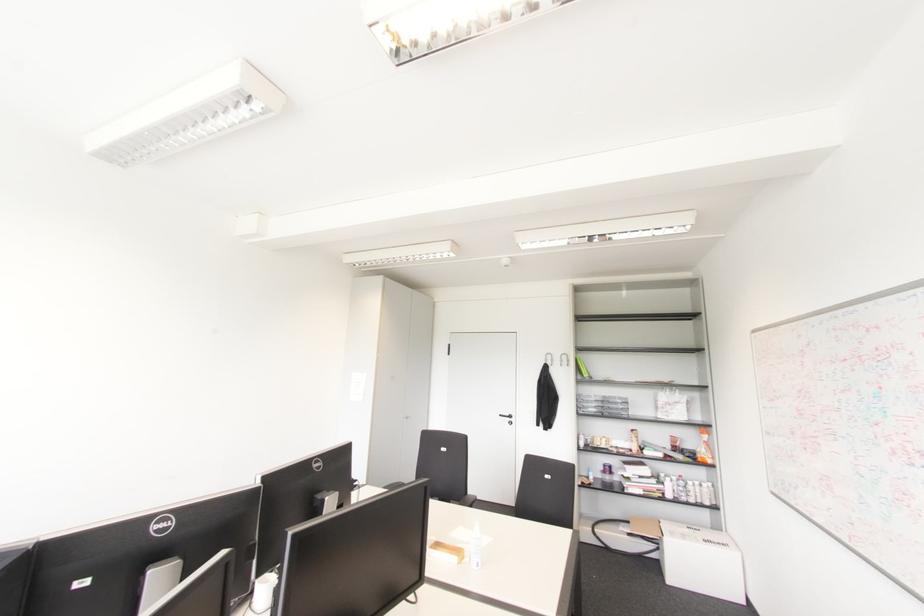
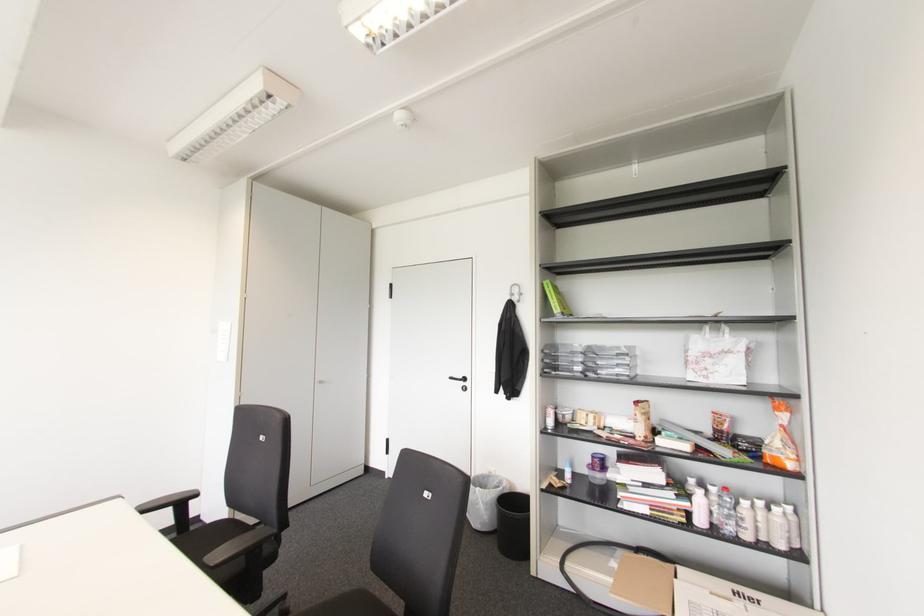
Locate, in the second image, the point that corresponds to pixel 682 407 in the first image.

(735, 361)